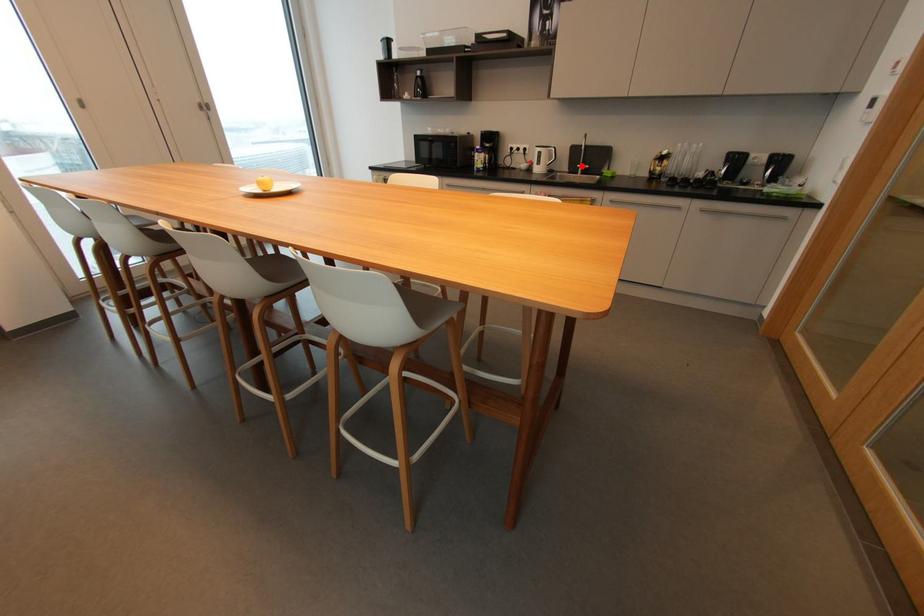
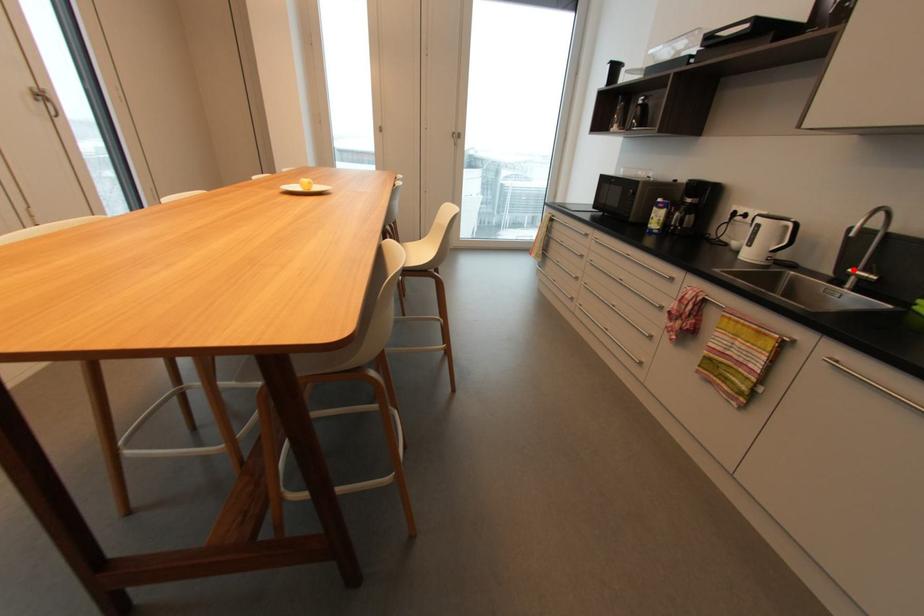
I am providing you with two images of the same scene from different viewpoints. A red point is marked on the first image and another point is marked on the second image. Is the marked point in image1 the same physical position as the marked point in image2?

Yes